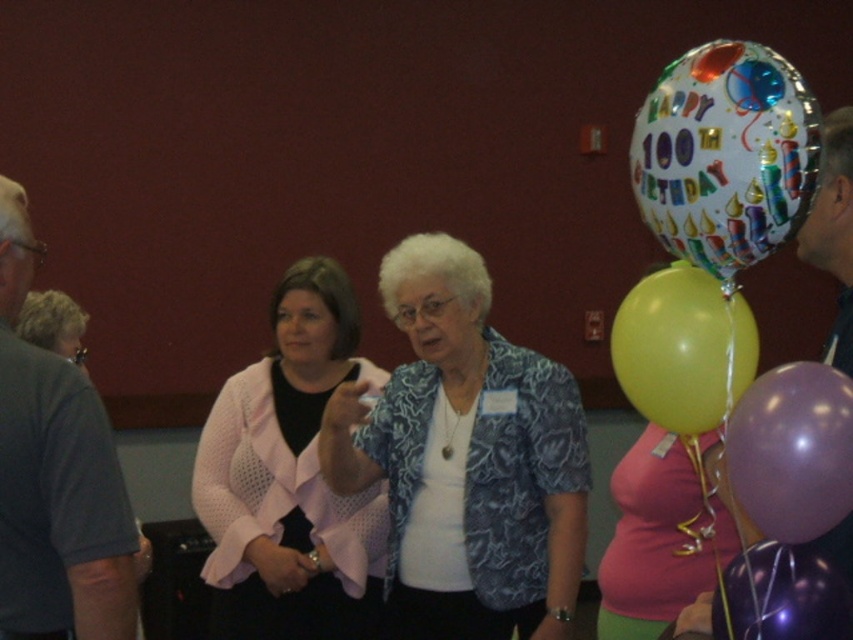
You are organizing a photo shoot and need to ensure that the blue textured blouse at center and the matte yellow balloon at right are both visible in the frame. Given that the camera can only capture objects up to the width of the wider object, will both items fit within the camera frame?

The blue textured blouse at center has a larger width than the matte yellow balloon at right. Since the camera can capture up to the width of the wider object, both items will fit within the frame as the blouse is wider and the balloon is narrower.

You are standing in the birthday party scene and want to move from the point closer to you to the point further away. Which path should you take between the two points, point (714,496) and point (787,488)?

You should move from point (714,496) to point (787,488) because point (714,496) is closer to you and point (787,488) is further away.